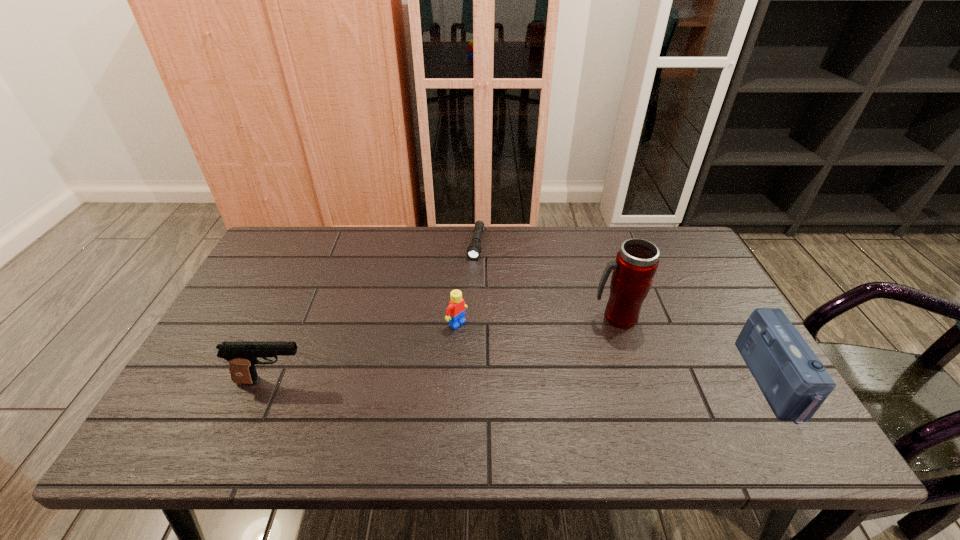
Locate an element on the screen. vacant region between the leftmost object and the fourth object from left to right is located at coordinates click(444, 349).

Locate an element on the screen. The image size is (960, 540). vacant space in between the farthest object and the thermos bottle is located at coordinates (546, 280).

Where is `empty space between the pistol and the camera`? empty space between the pistol and the camera is located at coordinates (522, 381).

In order to click on vacant point located between the leftmost object and the second shortest object in this screenshot , I will do `click(365, 352)`.

The image size is (960, 540). What are the coordinates of `unoccupied position between the rightmost object and the second object from right to left` in the screenshot? It's located at (694, 349).

I want to click on vacant space that's between the rightmost object and the pistol, so click(x=522, y=381).

Identify the location of blank region between the second object from right to left and the shortest object. The image size is (960, 540). (546, 280).

The height and width of the screenshot is (540, 960). Identify the location of free space between the farthest object and the Lego. (467, 284).

At what (x,y) coordinates should I click in order to perform the action: click on object that is the nearest to the farthest object. Please return your answer as a coordinate pair (x, y). The image size is (960, 540). Looking at the image, I should click on (455, 312).

Select which object appears as the second closest to the flashlight. Please provide its 2D coordinates. Your answer should be formatted as a tuple, i.e. [(x, y)], where the tuple contains the x and y coordinates of a point satisfying the conditions above.

[(636, 263)]